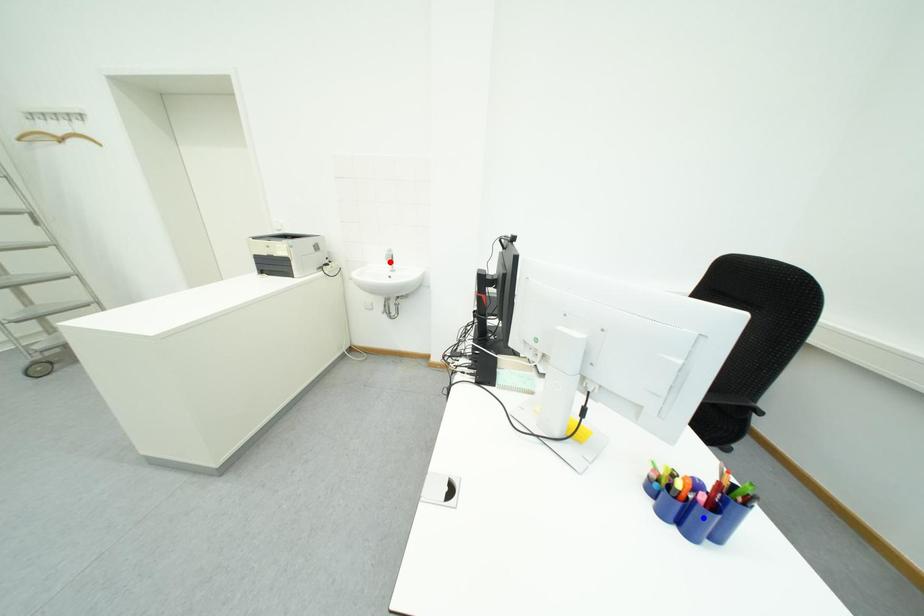
Question: Two points are marked on the image. Which point is closer to the camera?

Choices:
 (A) Blue point is closer.
 (B) Red point is closer.

Answer: (A)